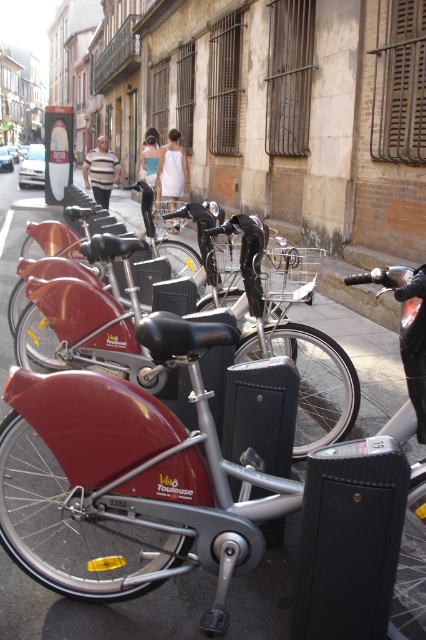
You are a tourist in Toulouse and want to rent a bike. You see two bikes at the center of the docking station. Which bike is closer to you, the matte red bicycle at center or the shiny metallic bicycle at center?

The matte red bicycle at center is closer to you because it is in front of the shiny metallic bicycle at center.

You are a delivery person who needs to choose a bike that can easily navigate narrow alleys. The matte red bicycle at center and the shiny metallic bicycle at center are available. Which bike would you choose and why?

You should choose the matte red bicycle at center because it has a smaller size compared to the shiny metallic bicycle at center, making it more maneuverable in narrow alleys.

You are a tourist in Toulouse and see the two bicycles at the center of the docking station. Which bicycle is positioned lower on the docking station, the matte red bicycle at center or the shiny metallic bicycle at center?

The matte red bicycle at center is located below the shiny metallic bicycle at center, so it is positioned lower on the docking station.